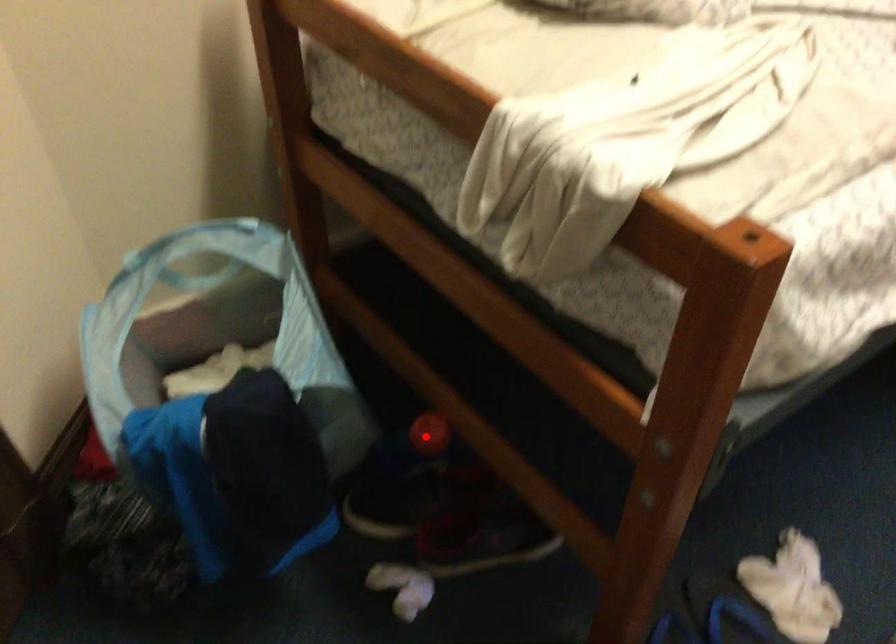
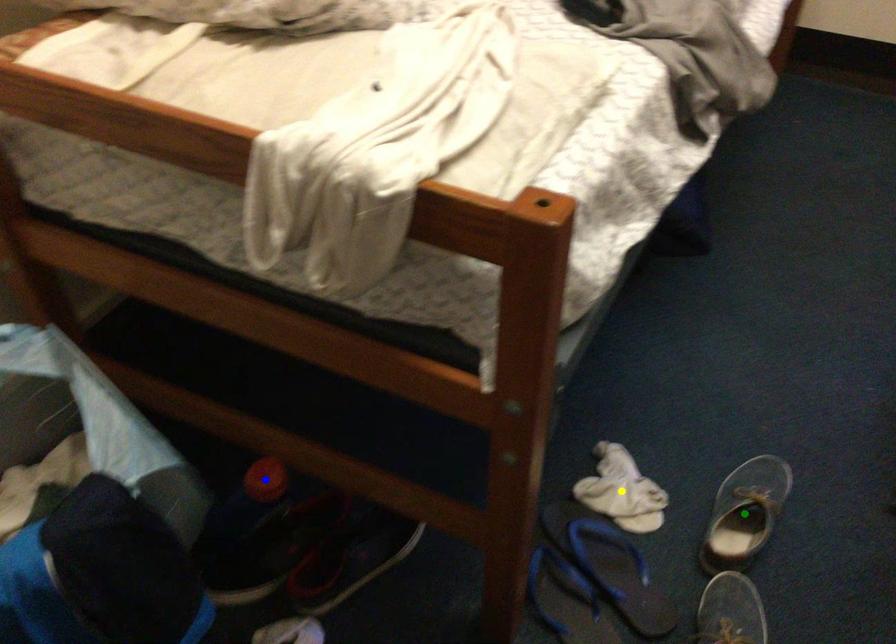
Question: I am providing you with two images of the same scene from different viewpoints. A red point is marked on the first image. You are given multiple points on the second image. Which mark in image 2 goes with the point in image 1?

Choices:
 (A) yellow point
 (B) blue point
 (C) green point

Answer: (B)